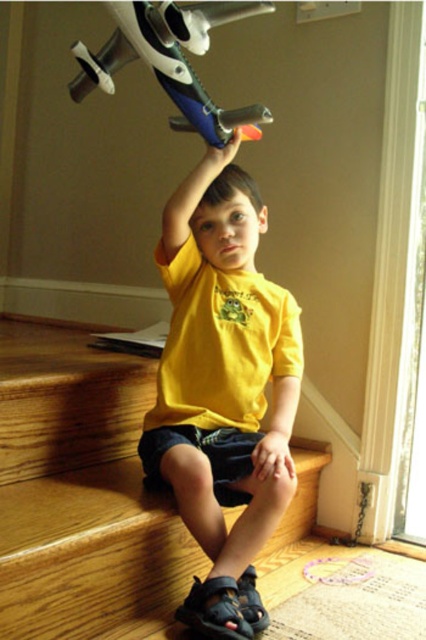
Can you confirm if matte plastic airplane at upper center is positioned below yellow matte shirt at center?

No.

Between point (124, 36) and point (264, 211), which one is positioned behind?

Point (264, 211)

You are a GUI agent. You are given a task and a screenshot of the screen. Output one action in this format:
    pyautogui.click(x=<x>, y=<y>)
    Task: Click on the matte plastic airplane at upper center
    This screenshot has height=640, width=426.
    Given the screenshot: What is the action you would take?
    pyautogui.click(x=172, y=61)

Can you confirm if yellow matte shirt at upper center is bigger than yellow matte shirt at center?

Yes.

This screenshot has height=640, width=426. What are the coordinates of `yellow matte shirt at upper center` in the screenshot? It's located at (222, 387).

Identify the location of yellow matte shirt at upper center. The height and width of the screenshot is (640, 426). (222, 387).

Is yellow matte shirt at upper center positioned before matte plastic airplane at upper center?

No, yellow matte shirt at upper center is behind matte plastic airplane at upper center.

Does point (259, 304) come closer to viewer compared to point (129, 24)?

No, (259, 304) is further to viewer.

This screenshot has width=426, height=640. What do you see at coordinates (222, 387) in the screenshot? I see `yellow matte shirt at upper center` at bounding box center [222, 387].

Image resolution: width=426 pixels, height=640 pixels. Identify the location of yellow matte shirt at upper center. (222, 387).